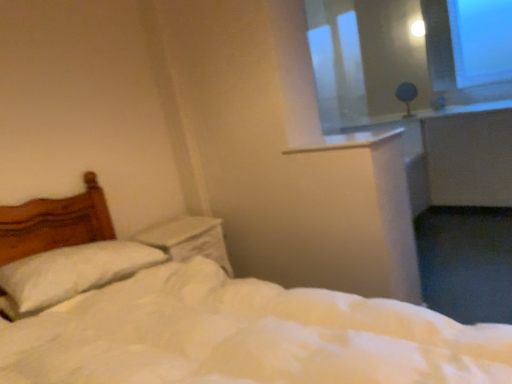
Question: Is white plastic window sill at upper center bigger than white soft pillow at left?

Choices:
 (A) yes
 (B) no

Answer: (B)

Question: Is white plastic window sill at upper center shorter than white soft pillow at left?

Choices:
 (A) yes
 (B) no

Answer: (A)

Question: Are white plastic window sill at upper center and white soft pillow at left located far from each other?

Choices:
 (A) yes
 (B) no

Answer: (A)

Question: Can you confirm if white plastic window sill at upper center is positioned to the right of white soft pillow at left?

Choices:
 (A) no
 (B) yes

Answer: (B)

Question: Can you confirm if white plastic window sill at upper center is smaller than white soft pillow at left?

Choices:
 (A) yes
 (B) no

Answer: (A)

Question: Relative to white soft pillow at left, is transparent plastic window screen at upper right in front or behind?

Choices:
 (A) behind
 (B) front

Answer: (A)

Question: In terms of height, does transparent plastic window screen at upper right look taller or shorter compared to white soft pillow at left?

Choices:
 (A) short
 (B) tall

Answer: (B)

Question: Is transparent plastic window screen at upper right to the left or to the right of white soft pillow at left in the image?

Choices:
 (A) right
 (B) left

Answer: (A)

Question: Does point (361, 117) appear closer or farther from the camera than point (10, 286)?

Choices:
 (A) closer
 (B) farther

Answer: (B)

Question: Considering the positions of white soft bed at center and transparent plastic window screen at upper right in the image, is white soft bed at center bigger or smaller than transparent plastic window screen at upper right?

Choices:
 (A) small
 (B) big

Answer: (B)

Question: From a real-world perspective, relative to transparent plastic window screen at upper right, is white soft bed at center vertically above or below?

Choices:
 (A) below
 (B) above

Answer: (A)

Question: Is point (296, 352) closer or farther from the camera than point (322, 59)?

Choices:
 (A) farther
 (B) closer

Answer: (B)

Question: Considering the relative positions of white soft bed at center and transparent plastic window screen at upper right in the image provided, is white soft bed at center to the left or to the right of transparent plastic window screen at upper right?

Choices:
 (A) right
 (B) left

Answer: (B)

Question: Relative to matte gray table lamp at upper right, is white soft pillow at left in front or behind?

Choices:
 (A) behind
 (B) front

Answer: (B)

Question: From a real-world perspective, is white soft pillow at left above or below matte gray table lamp at upper right?

Choices:
 (A) below
 (B) above

Answer: (A)